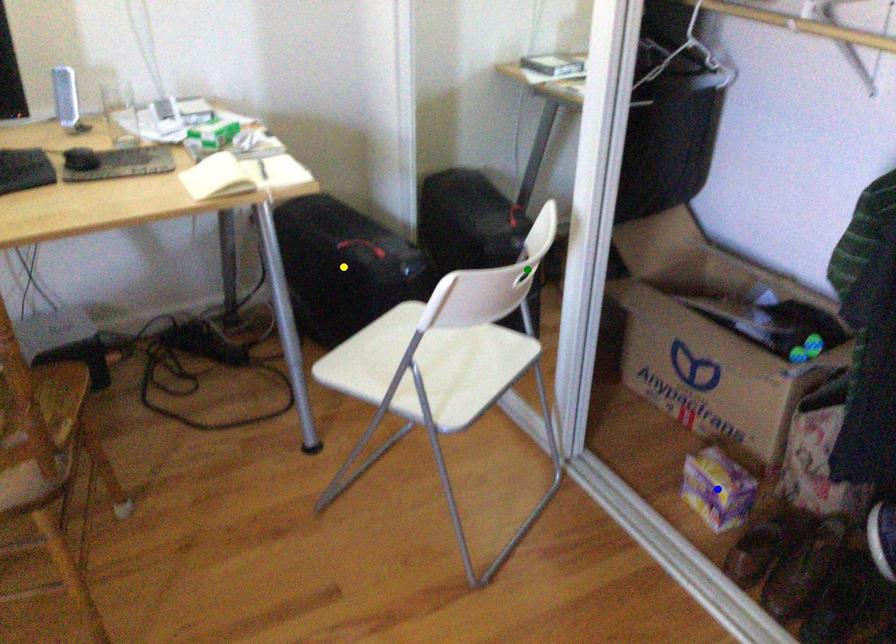
Order these from nearest to farthest:
green point, yellow point, blue point

green point → blue point → yellow point